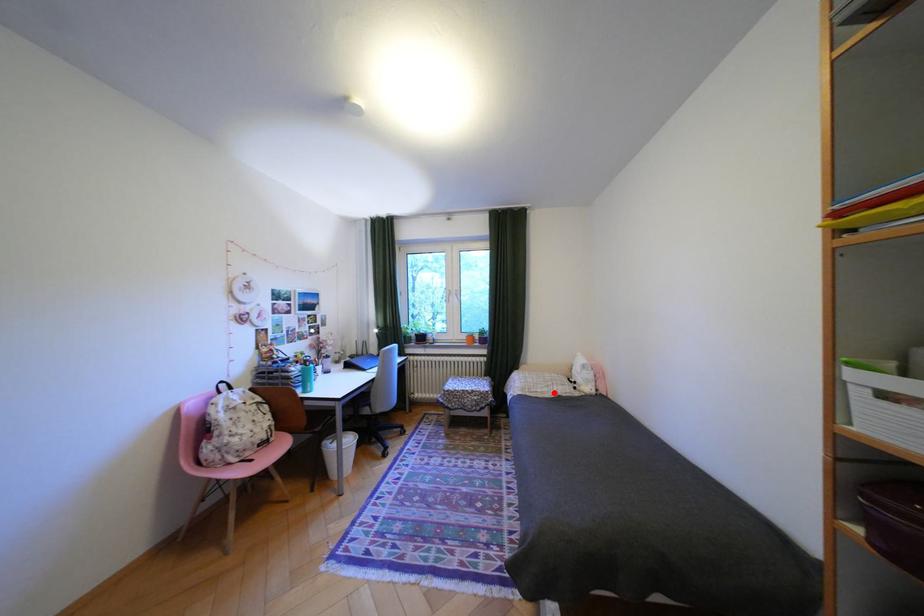
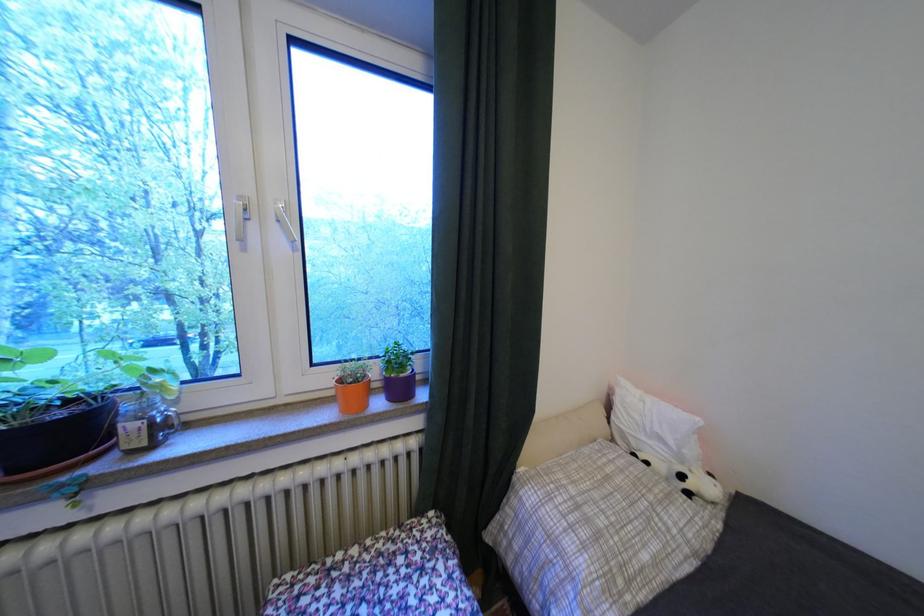
In the second image, find the point that corresponds to the highlighted location in the first image.

(667, 562)